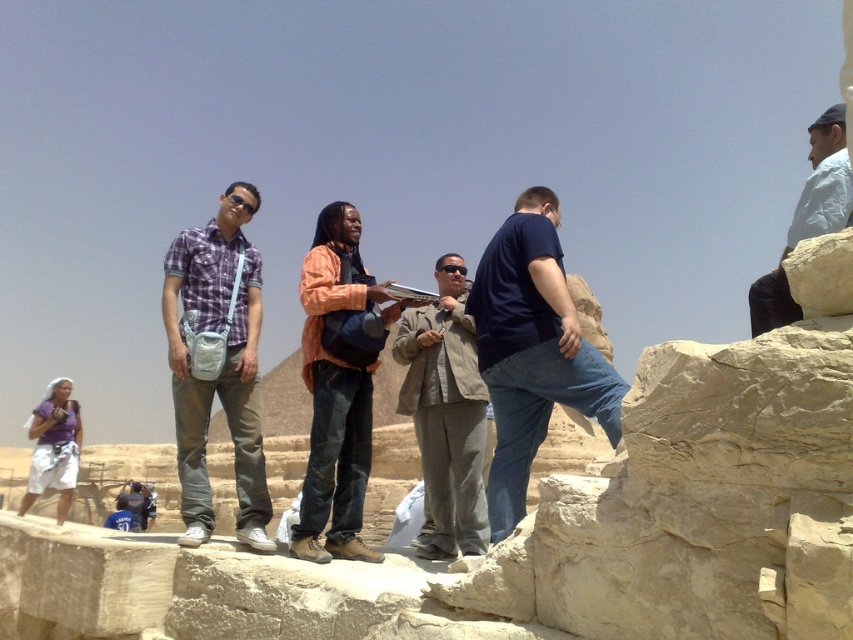
Is dark blue denim jeans at center taller than plaid cotton shirt at center?

Incorrect, dark blue denim jeans at center's height is not larger of plaid cotton shirt at center's.

Can you confirm if dark blue denim jeans at center is smaller than plaid cotton shirt at center?

Yes.

Which is behind, point (498, 308) or point (247, 544)?

Positioned behind is point (498, 308).

You are a GUI agent. You are given a task and a screenshot of the screen. Output one action in this format:
    pyautogui.click(x=<x>, y=<y>)
    Task: Click on the dark blue denim jeans at center
    
    Given the screenshot: What is the action you would take?
    (531, 349)

Can you confirm if dark blue denim jeans at center is positioned below gray matte jacket at center?

No.

Which is behind, point (515, 499) or point (459, 531)?

The point (459, 531) is behind.

Where is `dark blue denim jeans at center`? The height and width of the screenshot is (640, 853). dark blue denim jeans at center is located at coordinates (531, 349).

Between point (187, 490) and point (811, 211), which one is positioned in front?

Positioned in front is point (187, 490).

Who is shorter, plaid cotton shirt at center or white cotton shirt at upper right?

With less height is white cotton shirt at upper right.

What do you see at coordinates (221, 369) in the screenshot?
I see `plaid cotton shirt at center` at bounding box center [221, 369].

In order to click on plaid cotton shirt at center in this screenshot , I will do `click(221, 369)`.